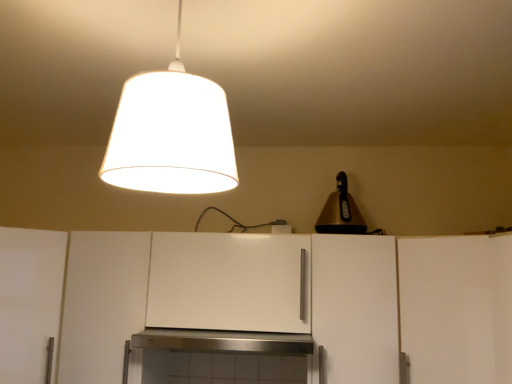
Question: Is white matte cabinet at lower left, the 4th cabinetry when ordered from right to left, wider than white matte cabinet at center, which appears as the 2th cabinetry when viewed from the right?

Choices:
 (A) no
 (B) yes

Answer: (A)

Question: Can you confirm if white matte cabinet at lower left, the 4th cabinetry when ordered from right to left, is smaller than white matte cabinet at center, which appears as the 2th cabinetry when viewed from the right?

Choices:
 (A) yes
 (B) no

Answer: (A)

Question: Is white matte cabinet at lower left, which appears as the 2th cabinetry when viewed from the left, oriented away from white matte cabinet at center, the fourth cabinetry positioned from the left?

Choices:
 (A) yes
 (B) no

Answer: (B)

Question: Is white matte cabinet at lower left, the 4th cabinetry when ordered from right to left, thinner than white matte cabinet at center, the fourth cabinetry positioned from the left?

Choices:
 (A) no
 (B) yes

Answer: (B)

Question: Can you confirm if white matte cabinet at lower left, the 4th cabinetry when ordered from right to left, is shorter than white matte cabinet at center, the fourth cabinetry positioned from the left?

Choices:
 (A) yes
 (B) no

Answer: (B)

Question: From a real-world perspective, does white matte cabinet at lower left, which appears as the 2th cabinetry when viewed from the left, sit lower than white matte cabinet at center, the fourth cabinetry positioned from the left?

Choices:
 (A) yes
 (B) no

Answer: (A)

Question: Is white matte cabinet at center, arranged as the third cabinetry when viewed from the right, to the left of white matte cabinet at left, the first cabinetry viewed from the left, from the viewer's perspective?

Choices:
 (A) yes
 (B) no

Answer: (B)

Question: Does white matte cabinet at center, which ranks as the third cabinetry in left-to-right order, turn towards white matte cabinet at left, the first cabinetry viewed from the left?

Choices:
 (A) no
 (B) yes

Answer: (A)

Question: From the image's perspective, would you say white matte cabinet at center, arranged as the third cabinetry when viewed from the right, is positioned over white matte cabinet at left, the first cabinetry viewed from the left?

Choices:
 (A) no
 (B) yes

Answer: (B)

Question: Is white matte cabinet at center, which ranks as the third cabinetry in left-to-right order, smaller than white matte cabinet at left, the first cabinetry viewed from the left?

Choices:
 (A) no
 (B) yes

Answer: (B)

Question: From a real-world perspective, is white matte cabinet at center, which ranks as the third cabinetry in left-to-right order, physically below white matte cabinet at left, the first cabinetry viewed from the left?

Choices:
 (A) yes
 (B) no

Answer: (B)

Question: Is white matte cabinet at left, the fifth cabinetry viewed from the right, at the back of white matte cabinet at center, which ranks as the third cabinetry in left-to-right order?

Choices:
 (A) yes
 (B) no

Answer: (B)

Question: From the image's perspective, is white matte cabinet at center, arranged as the third cabinetry when viewed from the right, on top of white matte cabinet at right, which ranks as the 1th cabinetry in right-to-left order?

Choices:
 (A) no
 (B) yes

Answer: (B)